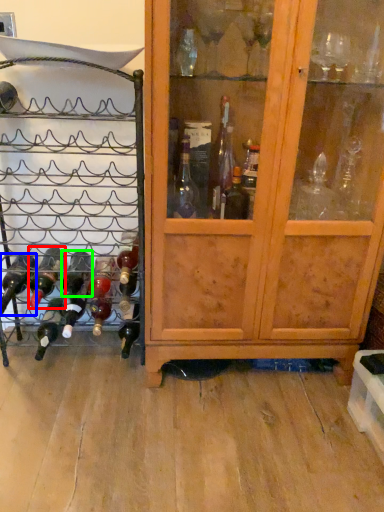
Question: Which is nearer to the bottle (highlighted by a red box)? bottle (highlighted by a blue box) or bottle (highlighted by a green box).

Choices:
 (A) bottle
 (B) bottle

Answer: (A)